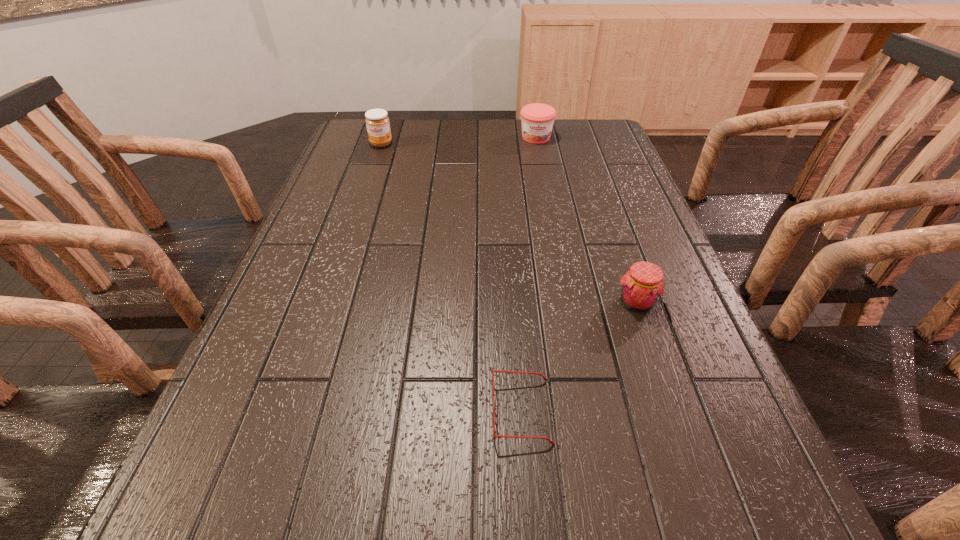
This screenshot has height=540, width=960. I want to click on the leftmost object, so click(x=377, y=122).

This screenshot has height=540, width=960. In order to click on the second jam from right to left in this screenshot , I will do `click(537, 119)`.

Where is `the rightmost object`? The height and width of the screenshot is (540, 960). the rightmost object is located at coordinates (642, 285).

The width and height of the screenshot is (960, 540). I want to click on the rightmost jam, so click(642, 285).

You are a GUI agent. You are given a task and a screenshot of the screen. Output one action in this format:
    pyautogui.click(x=<x>, y=<y>)
    Task: Click on the nearest object
    This screenshot has height=540, width=960.
    Given the screenshot: What is the action you would take?
    pyautogui.click(x=499, y=436)

At what (x,y) coordinates should I click in order to perform the action: click on the shortest object. Please return your answer as a coordinate pair (x, y). Looking at the image, I should click on (499, 436).

This screenshot has height=540, width=960. Find the location of `vacant area situated on the front label of the leftmost jam`. vacant area situated on the front label of the leftmost jam is located at coordinates (366, 189).

The width and height of the screenshot is (960, 540). I want to click on blank space located 0.250m on the front label of the second jam from right to left, so click(x=546, y=190).

The image size is (960, 540). What are the coordinates of `vacant space located 0.230m on the back of the rightmost jam` in the screenshot? It's located at (609, 222).

You are a GUI agent. You are given a task and a screenshot of the screen. Output one action in this format:
    pyautogui.click(x=<x>, y=<y>)
    Task: Click on the vacant space situated on the face of the shortest object
    The image size is (960, 540).
    Given the screenshot: What is the action you would take?
    pyautogui.click(x=383, y=412)